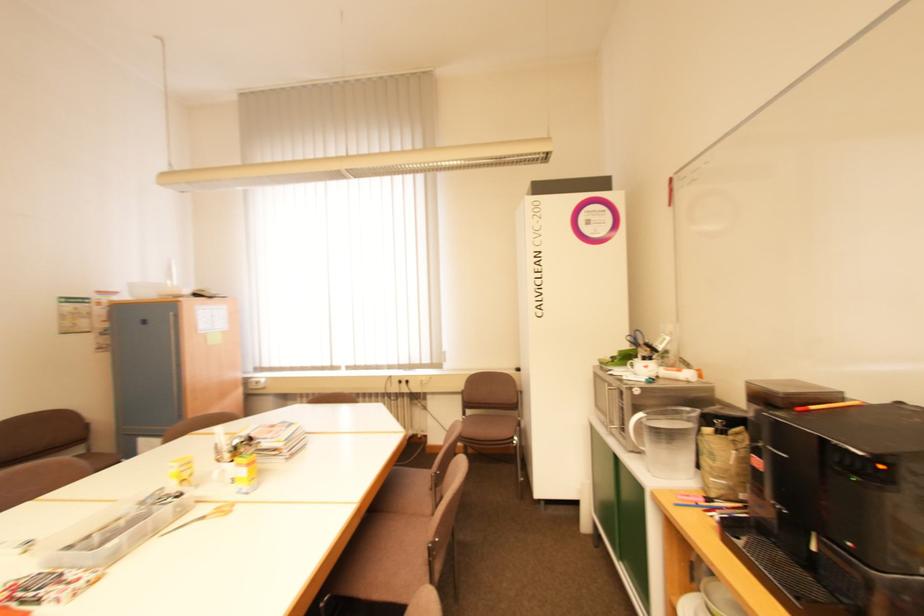
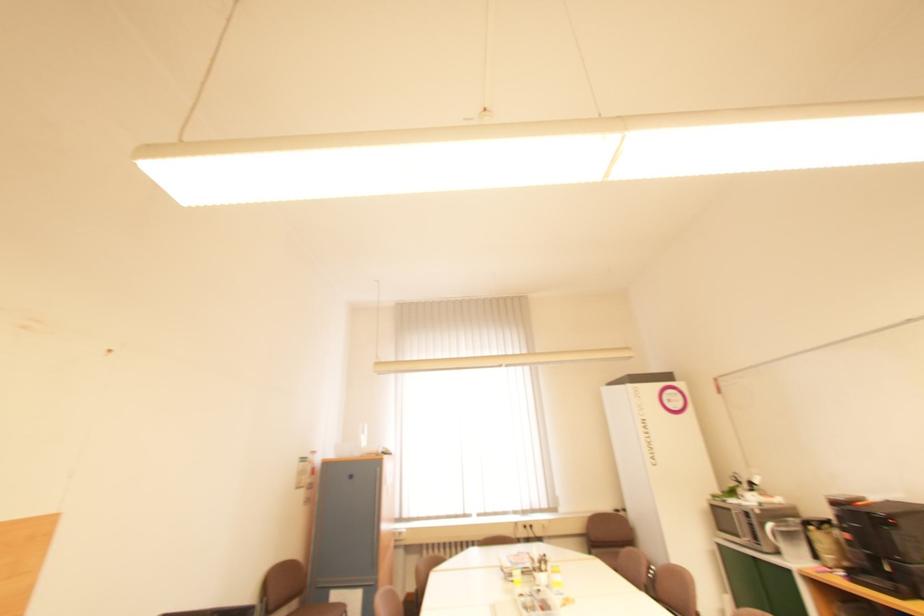
Which direction would the cameraman need to move to produce the second image?

The movement direction of the cameraman is left, backward.